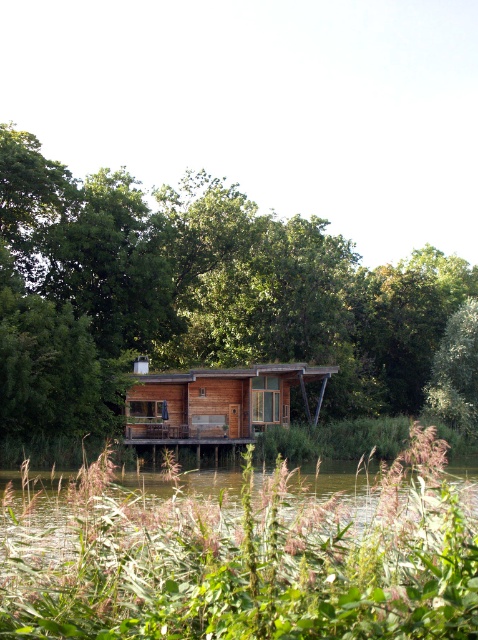
Question: Is green wood tree at center bigger than green leafy tree at center-right?

Choices:
 (A) yes
 (B) no

Answer: (A)

Question: Which point appears farthest from the camera in this image?

Choices:
 (A) (9, 188)
 (B) (299, 380)
 (C) (434, 451)
 (D) (473, 388)

Answer: (D)

Question: Which object is the farthest from the wooden cabin at center?

Choices:
 (A) green wood tree at center
 (B) green leafy plants at lower center

Answer: (B)

Question: Is green wood tree at center above green leafy plants at lower center?

Choices:
 (A) no
 (B) yes

Answer: (B)

Question: Does green leafy plants at lower center have a smaller size compared to wooden cabin at center?

Choices:
 (A) yes
 (B) no

Answer: (B)

Question: Which is nearer to the wooden cabin at center?

Choices:
 (A) green leafy plants at lower center
 (B) green wood tree at center
 (C) green leafy tree at center-right

Answer: (B)